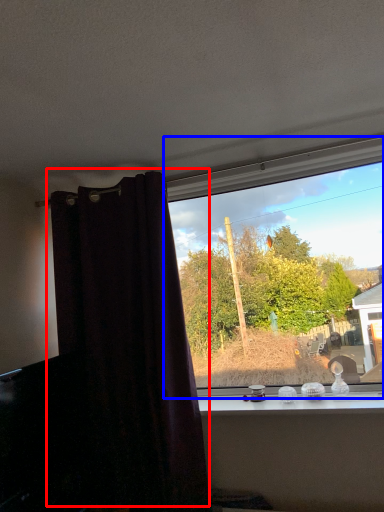
Question: Which object is closer to the camera taking this photo, curtain (highlighted by a red box) or window (highlighted by a blue box)?

Choices:
 (A) curtain
 (B) window

Answer: (A)